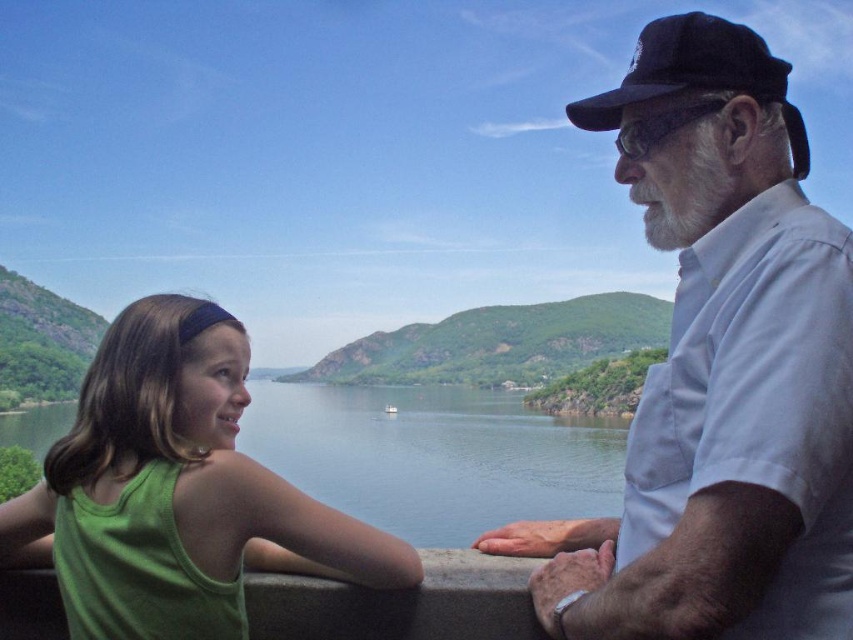
Based on the scene described, which object is positioned to the right of the other? Please choose between the white shirt at right and the green water at lower left.

The white shirt at right is to the right of the green water at lower left.

You are designing a new clothing line and want to ensure that the green fabric tank top at left and the black felt baseball cap at upper right can be worn together in a photoshoot. Based on their sizes, will the cap be able to sit comfortably on top of the tank top without any issues?

The green fabric tank top at left is shorter than the black felt baseball cap at upper right, so the cap can sit comfortably on top of the tank top without any issues.